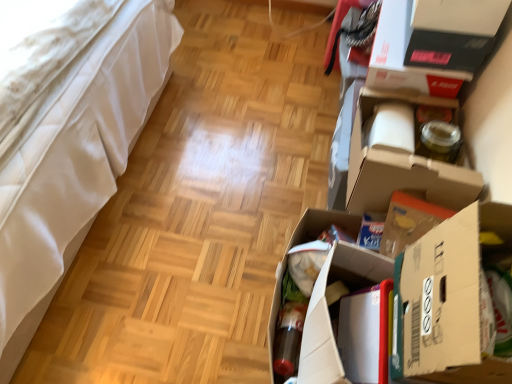
Identify the location of cardboard box at center, which is the 1th cardboard box from back to front. (329, 311).

Measure the distance between cardboard box at lower right, acting as the second cardboard box starting from the front, and camera.

86.88 centimeters.

Where is `matte black storage box at upper right`? The width and height of the screenshot is (512, 384). matte black storage box at upper right is located at coordinates (432, 43).

Based on the photo, could you tell me if white leather bed at left is turned towards white cardboard box at right, the third cardboard box from the back?

Yes, white leather bed at left is facing white cardboard box at right, the third cardboard box from the back.

Does white leather bed at left have a lesser width compared to white cardboard box at right, the third cardboard box from the back?

No, white leather bed at left is not thinner than white cardboard box at right, the third cardboard box from the back.

From the image's perspective, is white leather bed at left located above white cardboard box at right, the third cardboard box from the back?

Yes.

How far apart are white leather bed at left and white cardboard box at right, the third cardboard box from the back?

white leather bed at left and white cardboard box at right, the third cardboard box from the back, are 37.98 inches apart.

Does matte black storage box at upper right have a lesser height compared to cardboard box at lower right, the second cardboard box in the back-to-front sequence?

Indeed, matte black storage box at upper right has a lesser height compared to cardboard box at lower right, the second cardboard box in the back-to-front sequence.

Do you think matte black storage box at upper right is within cardboard box at lower right, the second cardboard box in the back-to-front sequence, or outside of it?

The correct answer is: outside.

Is matte black storage box at upper right to the left or to the right of white cardboard box at right, the 1th cardboard box in the front-to-back sequence, in the image?

matte black storage box at upper right is to the right of white cardboard box at right, the 1th cardboard box in the front-to-back sequence.

Where is `storage box that appears above the white cardboard box at right, the third cardboard box from the back (from the image's perspective)`? storage box that appears above the white cardboard box at right, the third cardboard box from the back (from the image's perspective) is located at coordinates (432, 43).

Does point (406, 6) lie in front of point (475, 259)?

That is False.

Consider the image. Is matte black storage box at upper right next to white cardboard box at right, the 1th cardboard box in the front-to-back sequence?

matte black storage box at upper right and white cardboard box at right, the 1th cardboard box in the front-to-back sequence, are clearly separated.

Is white cardboard box at right, the third cardboard box from the back, bigger or smaller than cardboard box at center, the third cardboard box positioned from the front?

Clearly, white cardboard box at right, the third cardboard box from the back, is smaller in size than cardboard box at center, the third cardboard box positioned from the front.

Considering the positions of objects white cardboard box at right, the 1th cardboard box in the front-to-back sequence, and cardboard box at center, which is the 1th cardboard box from back to front, in the image provided, who is behind, white cardboard box at right, the 1th cardboard box in the front-to-back sequence, or cardboard box at center, which is the 1th cardboard box from back to front,?

cardboard box at center, which is the 1th cardboard box from back to front, is further from the camera.

From a real-world perspective, is white cardboard box at right, the third cardboard box from the back, on cardboard box at center, the third cardboard box positioned from the front?

Correct, in the physical world, white cardboard box at right, the third cardboard box from the back, is higher than cardboard box at center, the third cardboard box positioned from the front.

Is cardboard box at center, which is the 1th cardboard box from back to front, at the back of white leather bed at left?

No, white leather bed at left is not facing the opposite direction of cardboard box at center, which is the 1th cardboard box from back to front.

Measure the distance from white leather bed at left to cardboard box at center, which is the 1th cardboard box from back to front.

white leather bed at left and cardboard box at center, which is the 1th cardboard box from back to front, are 32.08 inches apart.

From the image's perspective, is white leather bed at left located above or below cardboard box at center, the third cardboard box positioned from the front?

From the image's perspective, white leather bed at left appears above cardboard box at center, the third cardboard box positioned from the front.

Which is closer to the camera, (73, 222) or (365, 249)?

Point (73, 222) is farther from the camera than point (365, 249).

Considering the sizes of cardboard box at center, the third cardboard box positioned from the front, and white cardboard box at right, the third cardboard box from the back, in the image, is cardboard box at center, the third cardboard box positioned from the front, wider or thinner than white cardboard box at right, the third cardboard box from the back,?

Considering their sizes, cardboard box at center, the third cardboard box positioned from the front, looks broader than white cardboard box at right, the third cardboard box from the back.

Is cardboard box at center, the third cardboard box positioned from the front, inside or outside of white cardboard box at right, the third cardboard box from the back?

cardboard box at center, the third cardboard box positioned from the front, cannot be found inside white cardboard box at right, the third cardboard box from the back.

Considering the points (303, 381) and (414, 357), which point is behind, point (303, 381) or point (414, 357)?

Positioned behind is point (303, 381).

From a real-world perspective, relative to white cardboard box at right, the 1th cardboard box in the front-to-back sequence, is cardboard box at center, the third cardboard box positioned from the front, vertically above or below?

From a real-world perspective, cardboard box at center, the third cardboard box positioned from the front, is physically below white cardboard box at right, the 1th cardboard box in the front-to-back sequence.

Considering the relative positions of cardboard box at lower right, the second cardboard box in the back-to-front sequence, and white cardboard box at right, the third cardboard box from the back, in the image provided, is cardboard box at lower right, the second cardboard box in the back-to-front sequence, to the left of white cardboard box at right, the third cardboard box from the back, from the viewer's perspective?

Correct, you'll find cardboard box at lower right, the second cardboard box in the back-to-front sequence, to the left of white cardboard box at right, the third cardboard box from the back.

Between cardboard box at lower right, the second cardboard box in the back-to-front sequence, and white cardboard box at right, the third cardboard box from the back, which one has smaller size?

With smaller size is cardboard box at lower right, the second cardboard box in the back-to-front sequence.

Is cardboard box at lower right, the second cardboard box in the back-to-front sequence, placed right next to white cardboard box at right, the 1th cardboard box in the front-to-back sequence?

cardboard box at lower right, the second cardboard box in the back-to-front sequence, is not next to white cardboard box at right, the 1th cardboard box in the front-to-back sequence, and they're not touching.

What are the coordinates of `the 1st cardboard box behind the white cardboard box at right, the 1th cardboard box in the front-to-back sequence, counting from the anchor's position` in the screenshot? It's located at (304, 242).

This screenshot has width=512, height=384. In order to click on furniture located in front of the white cardboard box at right, the 1th cardboard box in the front-to-back sequence in this screenshot , I will do `click(69, 144)`.

Where is `storage box behind the cardboard box at lower right, the second cardboard box in the back-to-front sequence`? storage box behind the cardboard box at lower right, the second cardboard box in the back-to-front sequence is located at coordinates (432, 43).

Which object lies nearer to the anchor point matte black storage box at upper right, cardboard box at lower right, acting as the second cardboard box starting from the front, or white leather bed at left?

cardboard box at lower right, acting as the second cardboard box starting from the front, lies closer to matte black storage box at upper right than the other object.

Looking at the image, which one is located closer to cardboard box at center, which is the 1th cardboard box from back to front, cardboard box at lower right, acting as the second cardboard box starting from the front, or white cardboard box at right, the third cardboard box from the back?

The object closer to cardboard box at center, which is the 1th cardboard box from back to front, is cardboard box at lower right, acting as the second cardboard box starting from the front.

Looking at the image, which one is located further to white leather bed at left, cardboard box at lower right, acting as the second cardboard box starting from the front, or matte black storage box at upper right?

matte black storage box at upper right is positioned further to the anchor white leather bed at left.

Considering their positions, is cardboard box at lower right, the second cardboard box in the back-to-front sequence, positioned closer to matte black storage box at upper right than white cardboard box at right, the third cardboard box from the back?

The object closer to matte black storage box at upper right is cardboard box at lower right, the second cardboard box in the back-to-front sequence.

Estimate the real-world distances between objects in this image. Which object is closer to white leather bed at left, matte black storage box at upper right or cardboard box at lower right, acting as the second cardboard box starting from the front?

cardboard box at lower right, acting as the second cardboard box starting from the front, lies closer to white leather bed at left than the other object.

When comparing their distances from matte black storage box at upper right, does white leather bed at left or cardboard box at lower right, the second cardboard box in the back-to-front sequence, seem closer?

The object closer to matte black storage box at upper right is cardboard box at lower right, the second cardboard box in the back-to-front sequence.

From the image, which object appears to be farther from white leather bed at left, white cardboard box at right, the 1th cardboard box in the front-to-back sequence, or cardboard box at center, which is the 1th cardboard box from back to front?

white cardboard box at right, the 1th cardboard box in the front-to-back sequence, is further to white leather bed at left.

Considering their positions, is white leather bed at left positioned further to cardboard box at lower right, acting as the second cardboard box starting from the front, than white cardboard box at right, the 1th cardboard box in the front-to-back sequence?

The object further to cardboard box at lower right, acting as the second cardboard box starting from the front, is white leather bed at left.

The image size is (512, 384). What are the coordinates of `cardboard box between white cardboard box at right, the third cardboard box from the back, and cardboard box at center, the third cardboard box positioned from the front, along the z-axis` in the screenshot? It's located at (304, 242).

Identify the location of cardboard box between matte black storage box at upper right and cardboard box at center, the third cardboard box positioned from the front, in the up-down direction. (445, 308).

At what (x,y) coordinates should I click in order to perform the action: click on cardboard box located between white leather bed at left and cardboard box at lower right, acting as the second cardboard box starting from the front, in the left-right direction. Please return your answer as a coordinate pair (x, y). The width and height of the screenshot is (512, 384). Looking at the image, I should click on (329, 311).